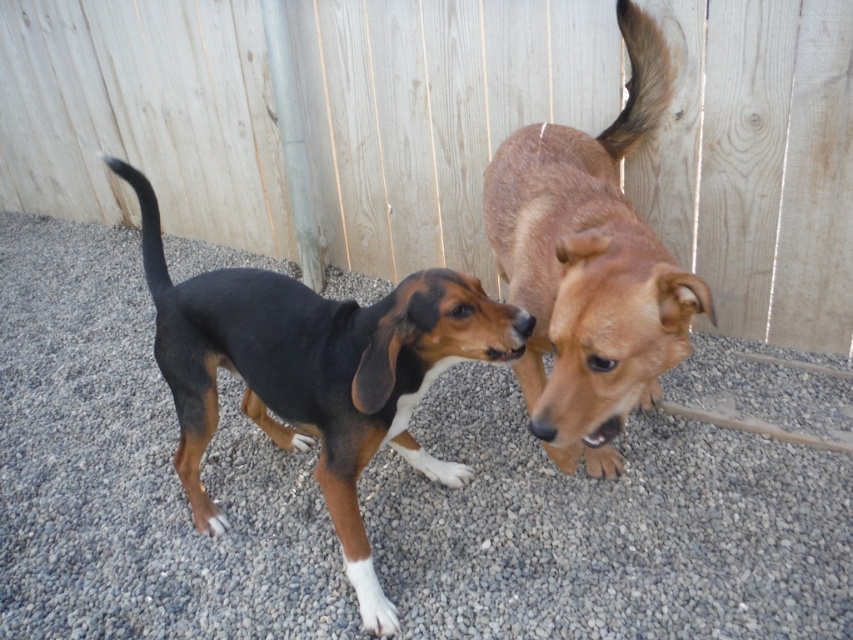
You are a photographer trying to capture both the black and brown fur dog at center and the brown furry dog at upper right in a single shot. Based on their positions, which dog should you focus on first to ensure both are in frame?

You should focus on the black and brown fur dog at center first because the brown furry dog at upper right is behind it, so positioning the camera to include the foreground dog will naturally include the background dog in the shot.

Looking at this image, you are a photographer trying to capture a photo of the black and brown fur dog at center without the wooden fence at upper center blocking the view. Can you determine if the fence will be visible in the background of the photo?

The wooden fence at upper center is much taller than the black and brown fur dog at center, so the fence will be visible in the background of the photo.